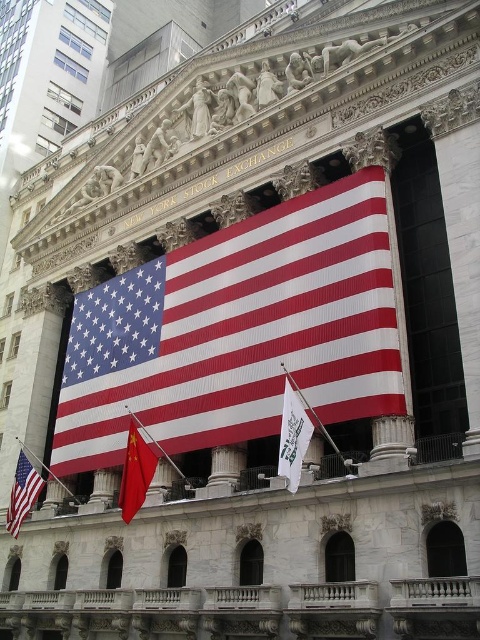
Can you confirm if red fabric flag at center is smaller than matte fabric flag at lower left?

Incorrect, red fabric flag at center is not smaller in size than matte fabric flag at lower left.

Between point (319, 403) and point (20, 458), which one is positioned in front?

Positioned in front is point (319, 403).

You are a GUI agent. You are given a task and a screenshot of the screen. Output one action in this format:
    pyautogui.click(x=<x>, y=<y>)
    Task: Click on the red fabric flag at center
    The height and width of the screenshot is (640, 480).
    Given the screenshot: What is the action you would take?
    pyautogui.click(x=238, y=332)

Find the location of a particular element. Image resolution: width=480 pixels, height=640 pixels. red fabric flag at center is located at coordinates 238,332.

Which of these two, white fabric flag at center or red fabric flag at lower center, stands shorter?

white fabric flag at center

Between white fabric flag at center and red fabric flag at lower center, which one appears on the left side from the viewer's perspective?

From the viewer's perspective, red fabric flag at lower center appears more on the left side.

Is point (286, 470) positioned after point (141, 483)?

No.

Identify the location of white fabric flag at center. (292, 436).

I want to click on red fabric flag at center, so click(x=238, y=332).

In the scene shown: Who is more forward, (267, 372) or (142, 500)?

Point (142, 500)

Where is `red fabric flag at center`? red fabric flag at center is located at coordinates (238, 332).